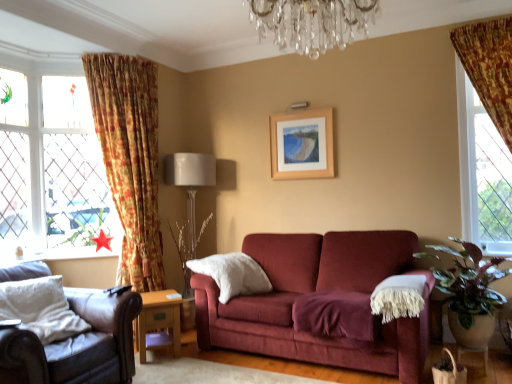
What do you see at coordinates (469, 289) in the screenshot?
I see `green leafy plant at right` at bounding box center [469, 289].

Find the location of a particular element. The height and width of the screenshot is (384, 512). crystal chandelier at upper center is located at coordinates (312, 22).

What do you see at coordinates (302, 145) in the screenshot?
I see `wooden picture frame at upper center` at bounding box center [302, 145].

Where is `green leafy plant at right`? This screenshot has height=384, width=512. green leafy plant at right is located at coordinates (469, 289).

Is white fabric lampshade at center oriented towards clear glass window at left?

No, white fabric lampshade at center is not facing towards clear glass window at left.

From the image's perspective, is white fabric lampshade at center on clear glass window at left?

No.

Identify the location of window in front of the white fabric lampshade at center. (52, 170).

Considering the relative sizes of white fabric lampshade at center and clear glass window at left in the image provided, is white fabric lampshade at center smaller than clear glass window at left?

No, white fabric lampshade at center is not smaller than clear glass window at left.

From the picture: Does crystal chandelier at upper center turn towards wooden side table at lower center?

No, crystal chandelier at upper center is not facing towards wooden side table at lower center.

Looking at this image, which is closer to the camera, (x=318, y=33) or (x=177, y=326)?

Positioned in front is point (x=318, y=33).

Considering the sizes of objects crystal chandelier at upper center and wooden side table at lower center in the image provided, who is bigger, crystal chandelier at upper center or wooden side table at lower center?

crystal chandelier at upper center.

Is crystal chandelier at upper center not near wooden side table at lower center?

Yes, crystal chandelier at upper center and wooden side table at lower center are quite far apart.

Is wooden picture frame at upper center closer to camera compared to crystal chandelier at upper center?

No, it is behind crystal chandelier at upper center.

Consider the image. Considering the sizes of objects wooden picture frame at upper center and crystal chandelier at upper center in the image provided, who is bigger, wooden picture frame at upper center or crystal chandelier at upper center?

Bigger between the two is crystal chandelier at upper center.

Which object is wider, wooden picture frame at upper center or crystal chandelier at upper center?

Wider between the two is crystal chandelier at upper center.

Between wooden side table at lower center and green leafy plant at right, which one has larger width?

With larger width is green leafy plant at right.

Image resolution: width=512 pixels, height=384 pixels. Find the location of `table below the green leafy plant at right (from the image's perspective)`. table below the green leafy plant at right (from the image's perspective) is located at coordinates (159, 318).

Relative to green leafy plant at right, is wooden side table at lower center in front or behind?

wooden side table at lower center is behind green leafy plant at right.

What's the angular difference between wooden side table at lower center and green leafy plant at right's facing directions?

49.2 degrees.

Is wooden side table at lower center next to white soft pillow at center and touching it?

No, wooden side table at lower center is not next to white soft pillow at center.

Who is taller, wooden side table at lower center or white soft pillow at center?

white soft pillow at center.

From the image's perspective, which is above, wooden side table at lower center or white soft pillow at center?

white soft pillow at center appears higher in the image.

Is wooden side table at lower center bigger or smaller than white soft pillow at center?

Clearly, wooden side table at lower center is smaller in size than white soft pillow at center.

From the image's perspective, would you say clear glass window at left is shown under wooden side table at lower center?

No.

Is clear glass window at left bigger or smaller than wooden side table at lower center?

Considering their sizes, clear glass window at left takes up more space than wooden side table at lower center.

From the picture: Would you say clear glass window at left is outside wooden side table at lower center?

Yes, clear glass window at left is located beyond the bounds of wooden side table at lower center.

Considering the positions of objects clear glass window at left and wooden side table at lower center in the image provided, who is more to the right, clear glass window at left or wooden side table at lower center?

wooden side table at lower center is more to the right.

Considering the points (257, 278) and (340, 36), which point is behind, point (257, 278) or point (340, 36)?

Point (257, 278)

Is white soft pillow at center aimed at crystal chandelier at upper center?

No, white soft pillow at center is not oriented towards crystal chandelier at upper center.

In terms of size, does white soft pillow at center appear bigger or smaller than crystal chandelier at upper center?

white soft pillow at center is bigger than crystal chandelier at upper center.

Which of these two, white soft pillow at center or crystal chandelier at upper center, stands shorter?

crystal chandelier at upper center is shorter.

I want to click on lamp below the clear glass window at left (from a real-world perspective), so click(189, 199).

In order to click on light fixture on the right of wooden side table at lower center in this screenshot , I will do `click(312, 22)`.

From the image, which object appears to be nearer to wooden side table at lower center, clear glass window at left or white soft pillow at center?

Based on the image, white soft pillow at center appears to be nearer to wooden side table at lower center.

Considering their positions, is white fabric lampshade at center positioned further to leather armchair at lower left than red paper star at lower left?

Based on the image, red paper star at lower left appears to be further to leather armchair at lower left.

Looking at the image, which one is located closer to clear glass window at left, leather armchair at lower left or green leafy plant at right?

leather armchair at lower left.

In the scene shown: From the image, which object appears to be farther from white soft pillow at center, white fabric lampshade at center or floral fabric curtain at left?

floral fabric curtain at left is further to white soft pillow at center.

From the image, which object appears to be farther from white soft pillow at center, leather armchair at lower left or green leafy plant at right?

The object further to white soft pillow at center is green leafy plant at right.

When comparing their distances from green leafy plant at right, does crystal chandelier at upper center or clear glass window at left seem closer?

crystal chandelier at upper center is closer to green leafy plant at right.

Estimate the real-world distances between objects in this image. Which object is further from white soft pillow at center, green leafy plant at right or leather armchair at lower left?

Based on the image, green leafy plant at right appears to be further to white soft pillow at center.

Considering their positions, is white fabric lampshade at center positioned closer to red paper star at lower left than white soft pillow at center?

white fabric lampshade at center lies closer to red paper star at lower left than the other object.

Locate an element on the screen. This screenshot has width=512, height=384. picture frame between crystal chandelier at upper center and white fabric lampshade at center in the front-back direction is located at coordinates (302, 145).

Find the location of a particular element. The height and width of the screenshot is (384, 512). table located between red paper star at lower left and white fabric lampshade at center in the left-right direction is located at coordinates (159, 318).

I want to click on lamp between red paper star at lower left and white soft pillow at center, so click(189, 199).

The height and width of the screenshot is (384, 512). Find the location of `lamp between wooden side table at lower center and green leafy plant at right in the horizontal direction`. lamp between wooden side table at lower center and green leafy plant at right in the horizontal direction is located at coordinates (189, 199).